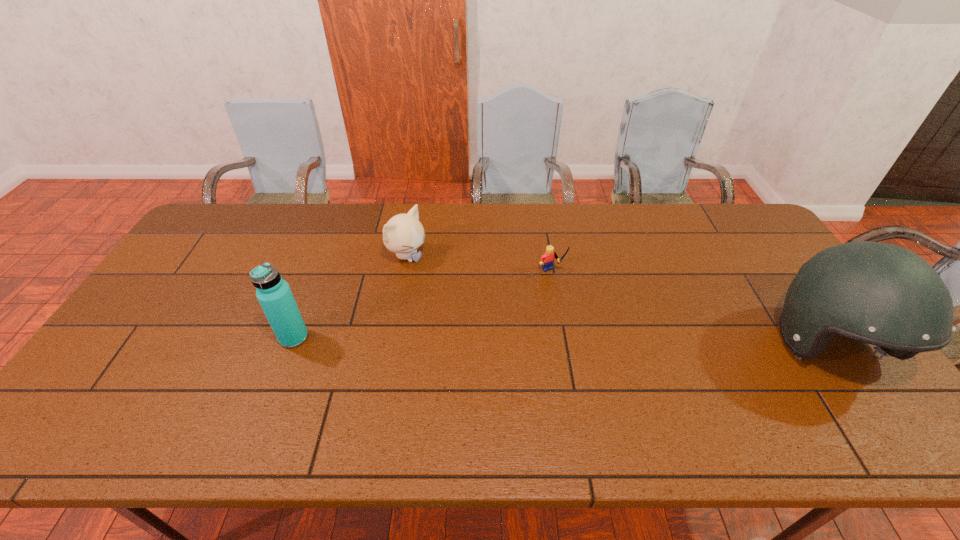
The height and width of the screenshot is (540, 960). What are the coordinates of `free space between the rightmost object and the leftmost object` in the screenshot? It's located at (561, 342).

Identify the location of vacant area that lies between the second object from right to left and the leftmost object. (422, 305).

The width and height of the screenshot is (960, 540). In order to click on vacant region between the third tallest object and the tallest object in this screenshot , I will do `click(618, 301)`.

Where is `vacant region between the tallest object and the shortest object`? vacant region between the tallest object and the shortest object is located at coordinates (689, 309).

The width and height of the screenshot is (960, 540). I want to click on object that ranks as the closest to the leftmost object, so tap(403, 234).

The height and width of the screenshot is (540, 960). I want to click on object that can be found as the closest to the leftmost object, so click(x=403, y=234).